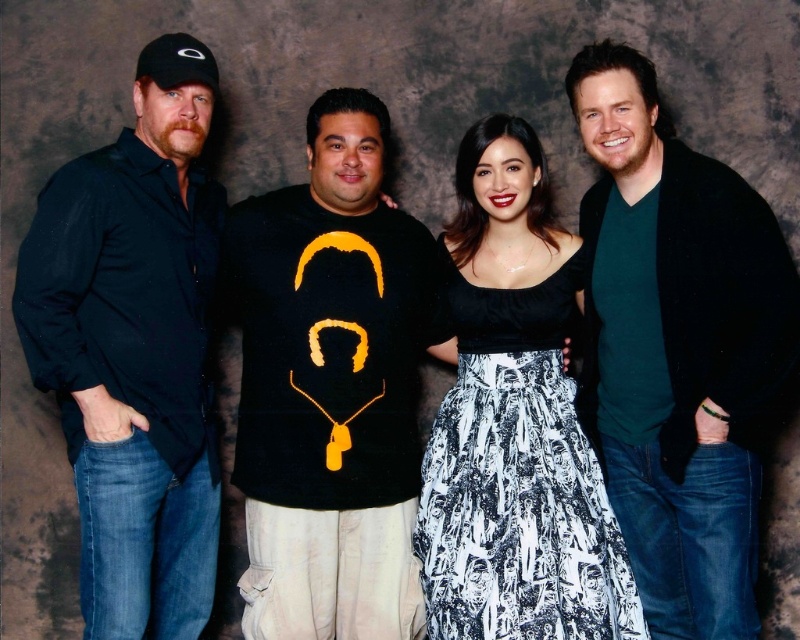
Can you confirm if black matte shirt at left is thinner than black satin dress at center?

Yes.

This screenshot has width=800, height=640. Describe the element at coordinates (134, 348) in the screenshot. I see `black matte shirt at left` at that location.

Which is in front, point (76, 413) or point (536, 330)?

Point (76, 413) is in front.

This screenshot has height=640, width=800. I want to click on black matte shirt at left, so click(134, 348).

From the picture: Can you confirm if green matte shirt at center is wider than black matte shirt at left?

Indeed, green matte shirt at center has a greater width compared to black matte shirt at left.

Is point (721, 637) positioned in front of point (82, 554)?

Yes, it is in front of point (82, 554).

The height and width of the screenshot is (640, 800). What are the coordinates of `green matte shirt at center` in the screenshot? It's located at (678, 348).

Can you confirm if green matte shirt at center is positioned to the left of black satin dress at center?

In fact, green matte shirt at center is to the right of black satin dress at center.

Looking at this image, does green matte shirt at center have a smaller size compared to black satin dress at center?

Yes.

You are a GUI agent. You are given a task and a screenshot of the screen. Output one action in this format:
    pyautogui.click(x=<x>, y=<y>)
    Task: Click on the green matte shirt at center
    
    Given the screenshot: What is the action you would take?
    click(x=678, y=348)

The height and width of the screenshot is (640, 800). What are the coordinates of `green matte shirt at center` in the screenshot? It's located at (678, 348).